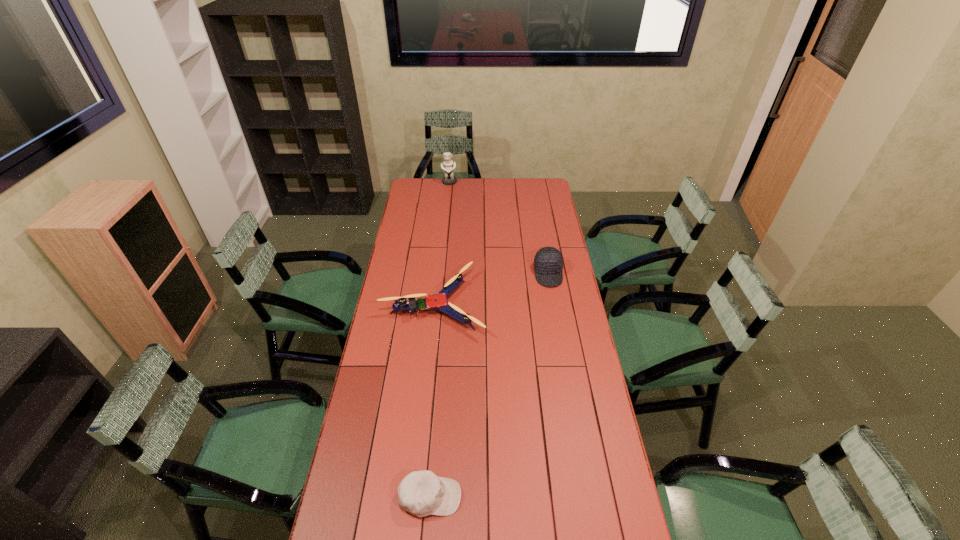
The height and width of the screenshot is (540, 960). In order to click on empty space that is in between the left baseball cap and the drone in this screenshot , I will do `click(432, 401)`.

Locate an element on the screen. blank region between the drone and the figurine is located at coordinates (442, 244).

Where is `unoccupied area between the drone and the shorter baseball cap`? The image size is (960, 540). unoccupied area between the drone and the shorter baseball cap is located at coordinates (432, 401).

Locate an element on the screen. vacant area between the rightmost object and the tallest object is located at coordinates (499, 228).

At what (x,y) coordinates should I click in order to perform the action: click on free space between the left baseball cap and the drone. Please return your answer as a coordinate pair (x, y). The width and height of the screenshot is (960, 540). Looking at the image, I should click on click(432, 401).

Where is `free space between the drone and the tallest object`? This screenshot has width=960, height=540. free space between the drone and the tallest object is located at coordinates (442, 244).

Locate an element on the screen. The width and height of the screenshot is (960, 540). empty space between the farther baseball cap and the shorter baseball cap is located at coordinates (490, 386).

Image resolution: width=960 pixels, height=540 pixels. In order to click on vacant area that lies between the drone and the rightmost object in this screenshot , I will do (492, 289).

The image size is (960, 540). Find the location of `free space that is in between the drone and the left baseball cap`. free space that is in between the drone and the left baseball cap is located at coordinates (432, 401).

What are the coordinates of `object that is the third closest one to the rightmost object` in the screenshot? It's located at (421, 493).